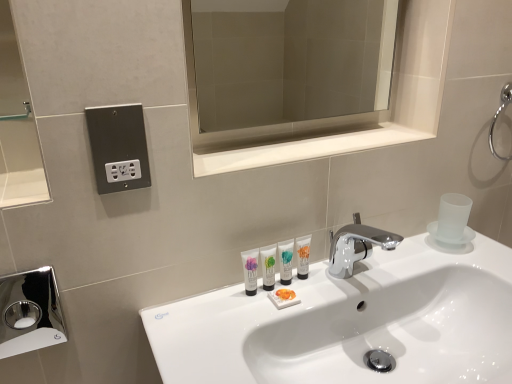
Where is `free location to the right of white glossy tube at center, positioned as the first mouthwash in right-to-left order`? The image size is (512, 384). free location to the right of white glossy tube at center, positioned as the first mouthwash in right-to-left order is located at coordinates (357, 279).